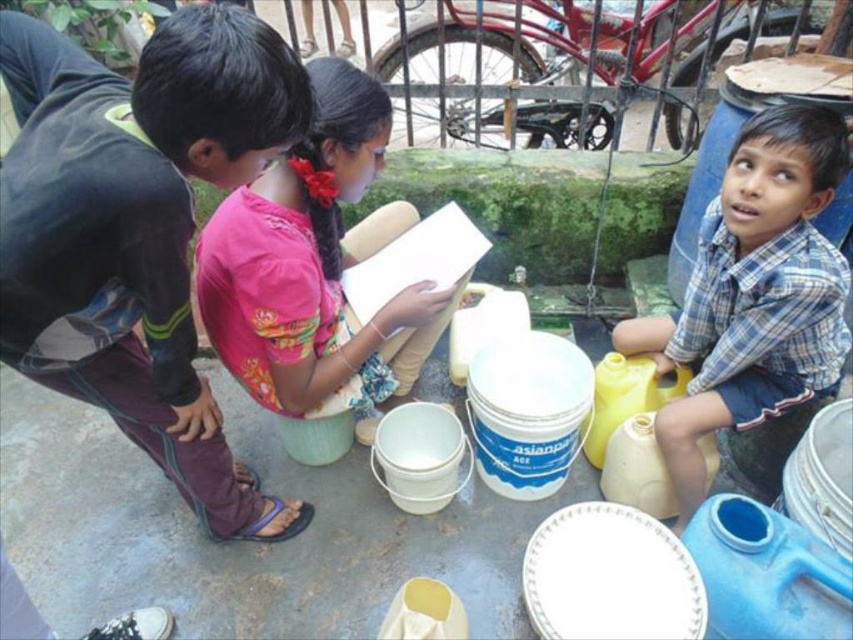
You are a parent observing children playing in the water area. You notice the dark purple pants at left and the pink fabric shirt at center. Which clothing item is closer to the ground?

The dark purple pants at left is located below the pink fabric shirt at center, so it is closer to the ground.

You are a photographer trying to capture both the dark purple pants at left and the blue plaid shirt at center in a single shot. Which one should you focus on first to ensure both are in focus?

You should focus on the dark purple pants at left first since it is closer to the viewer than the blue plaid shirt at center, ensuring both will be in focus when using a shallow depth of field.

You are a tailor who needs to determine if the dark purple pants at left can fit through a narrow doorway that the blue plaid shirt at center is currently blocking. Can the pants pass through without removing the shirt?

The dark purple pants at left might be wider than blue plaid shirt at center, so there is a possibility that they cannot pass through the doorway without adjusting or moving the shirt.